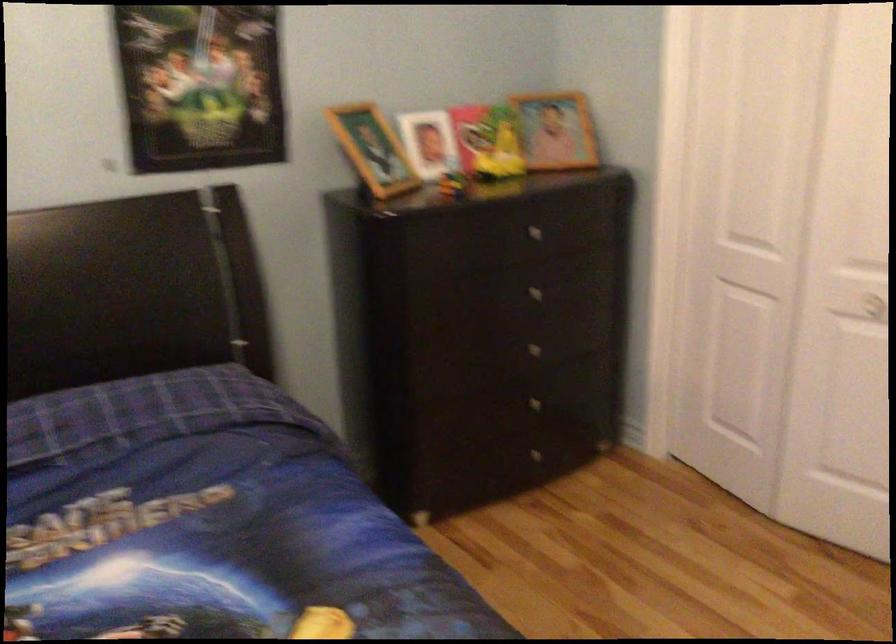
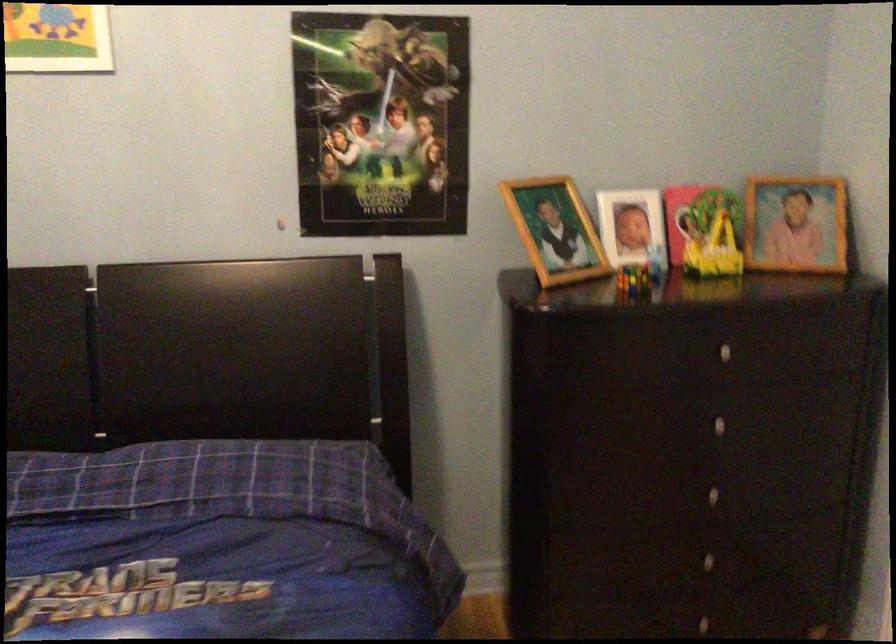
Find the pixel in the second image that matches point 373,147 in the first image.

(555, 230)